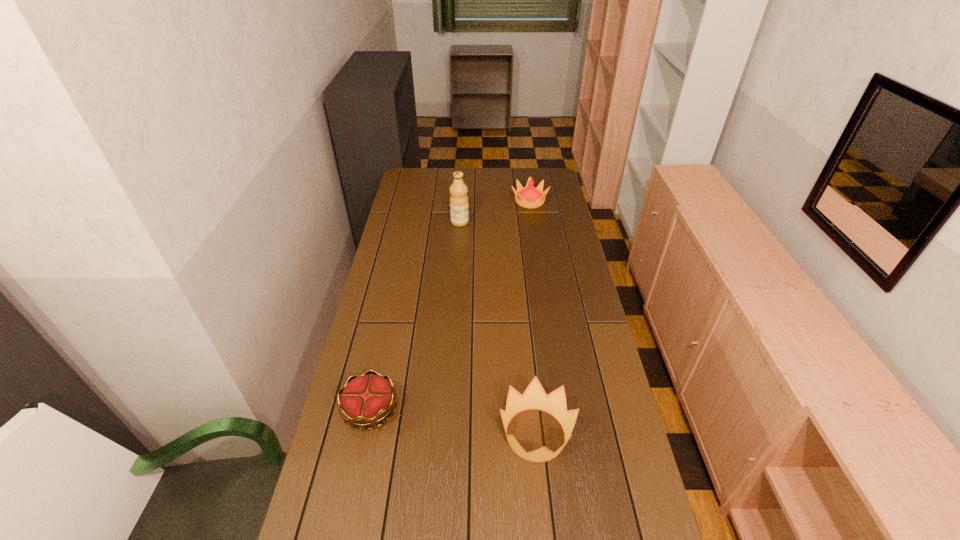
This screenshot has height=540, width=960. Find the location of `object that is the closest to the farthest crown`. object that is the closest to the farthest crown is located at coordinates (459, 212).

Select which object is the second closest to the tallest object. Please provide its 2D coordinates. Your answer should be formatted as a tuple, i.e. [(x, y)], where the tuple contains the x and y coordinates of a point satisfying the conditions above.

[(365, 400)]

Identify the location of crown that is the closest one to the farthest object. (534, 397).

The image size is (960, 540). I want to click on the closest crown to the shortest crown, so click(x=534, y=397).

Locate an element on the screen. free location that satisfies the following two spatial constraints: 1. on the front side of the farthest object; 2. on the label of the third nearest object is located at coordinates (533, 222).

At what (x,y) coordinates should I click in order to perform the action: click on vacant space that satisfies the following two spatial constraints: 1. on the back side of the leftmost crown; 2. on the left side of the farthest crown. Please return your answer as a coordinate pair (x, y). This screenshot has height=540, width=960. Looking at the image, I should click on (415, 201).